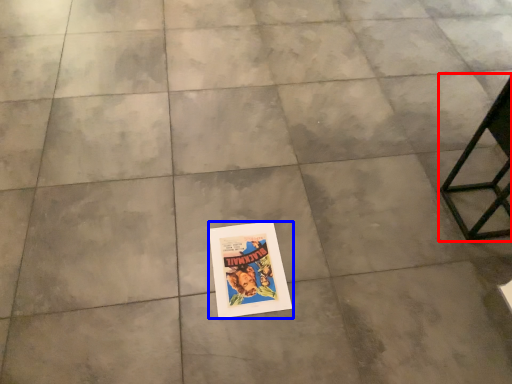
Question: Which point is closer to the camera, furniture (highlighted by a red box) or poster (highlighted by a blue box)?

Choices:
 (A) furniture
 (B) poster

Answer: (A)